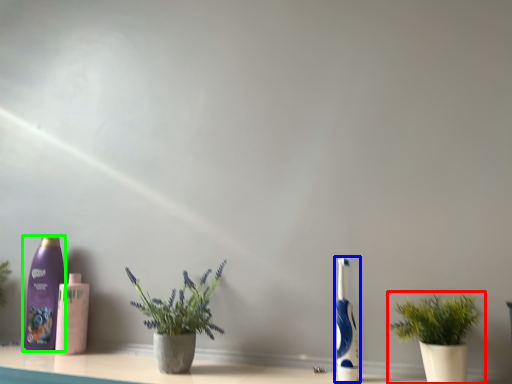
Question: Which object is positioned closest to houseplant (highlighted by a red box)? Select from toothbrush (highlighted by a blue box) and bottle (highlighted by a green box).

Choices:
 (A) toothbrush
 (B) bottle

Answer: (A)